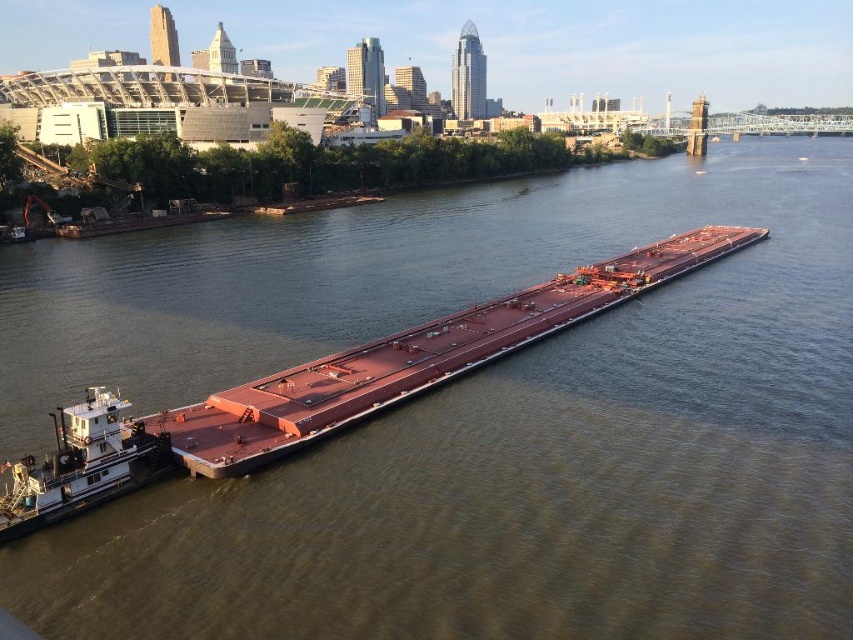
You are standing at point A located at coordinates point A at (x=231, y=397). You want to reach point B located at coordinates point B at 0.555, 0.333. The barge is moving towards point B at a speed of 15 km per hour. If you start moving towards point B at the same time the barge departs, what is the minimum speed you need to reach point B before the barge?

The distance between point A at (x=231, y=397) and point B at 0.555, 0.333 is 55.60 meters. To reach point B before the barge, you must travel faster than the barge. The barge travels at 15 km per hour, which converts to approximately 4.1667 meters per second. The time taken by the barge to reach point B is distance divided by speed, so 55.60 meters divided by 4.1667 mps equals approximately 13.34 seconds. Therefore, you need to cover the 55.60 meters in less than 13.34 seconds. The required speed is distance